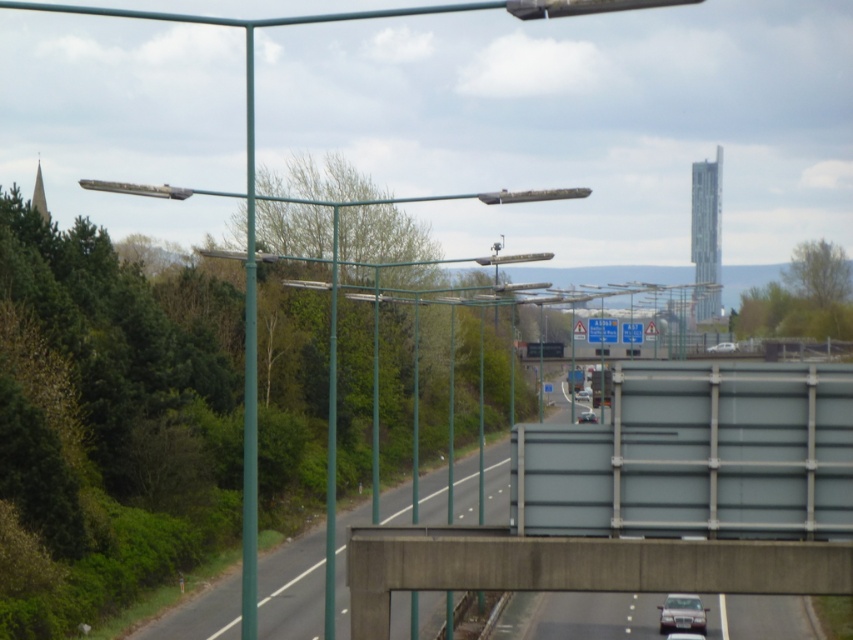
You are a driver approaching the blue plastic sign at center and the silver metallic sedan at center on the highway. Which object will you see first as you drive towards them?

The blue plastic sign at center is closer to the viewer than the silver metallic sedan at center, so you will see the blue plastic sign at center first as you drive towards them.

You are standing at the viewpoint of the image and want to reach the point marked as point (x=587, y=337). If your walking speed is 3 feet per second, how many seconds will it take you to reach that point?

The distance between you and point (x=587, y=337) is 326.42 feet. At a walking speed of 3 feet per second, it would take approximately 108.8 seconds to reach the point.